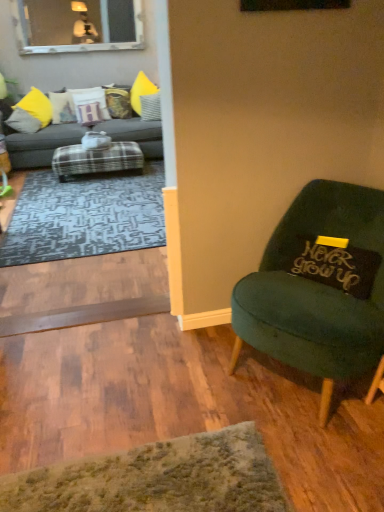
The width and height of the screenshot is (384, 512). Find the location of `blank space above black fabric pillow at right, which is counted as the 1th pillow, starting from the bottom (from a real-world perspective)`. blank space above black fabric pillow at right, which is counted as the 1th pillow, starting from the bottom (from a real-world perspective) is located at coordinates (331, 237).